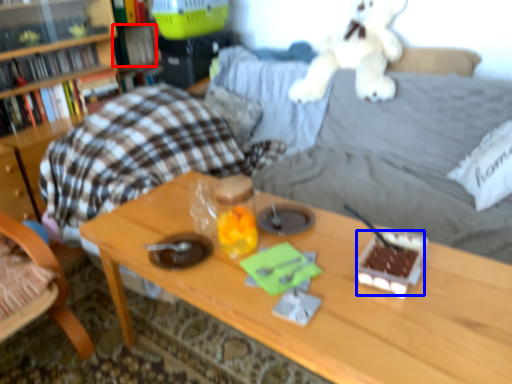
Question: Which object appears closest to the camera in this image, book (highlighted by a red box) or food (highlighted by a blue box)?

Choices:
 (A) book
 (B) food

Answer: (B)